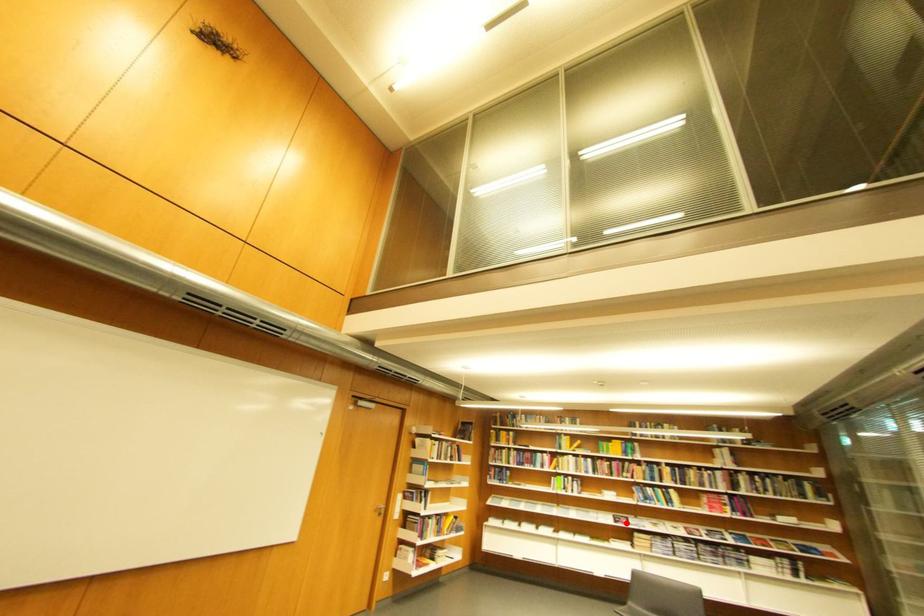
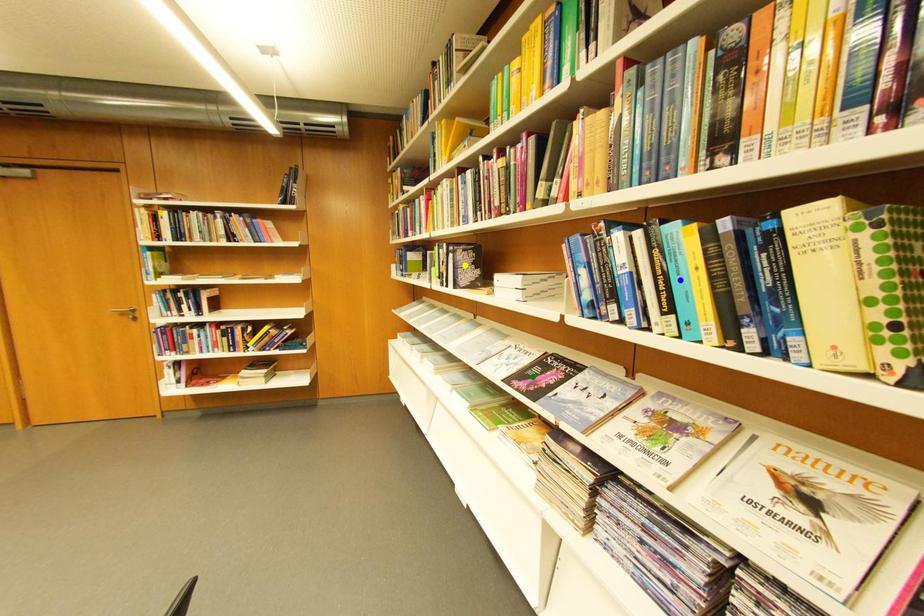
Question: I am providing you with two images of the same scene from different viewpoints. A red point is marked on the first image. You are given multiple points on the second image. Which point in image 2 is actually the same real-world point as the red point in image 1?

Choices:
 (A) yellow point
 (B) blue point
 (C) green point

Answer: (C)